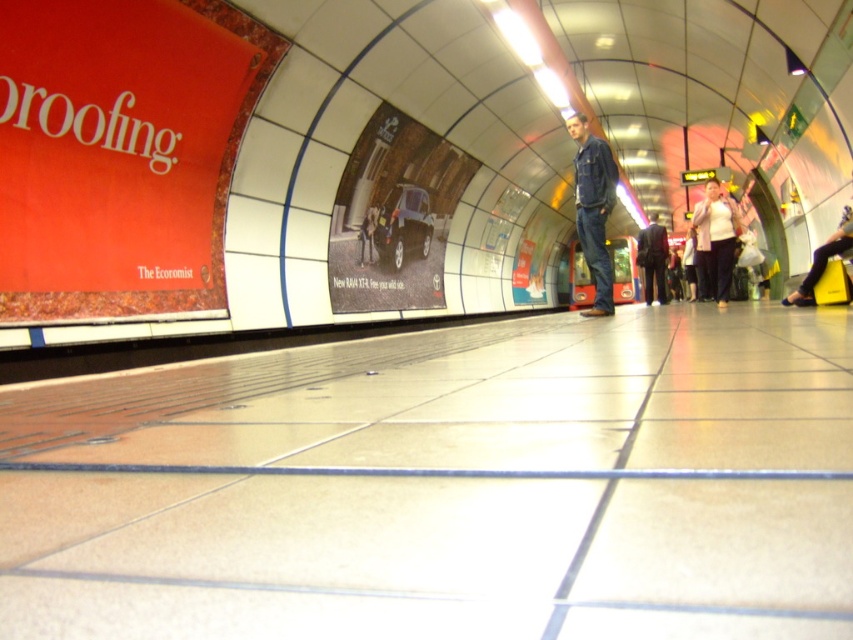
What is the exact location of the white textured sweater at right in the subway station platform?

The white textured sweater at right is located at point (717, 237).